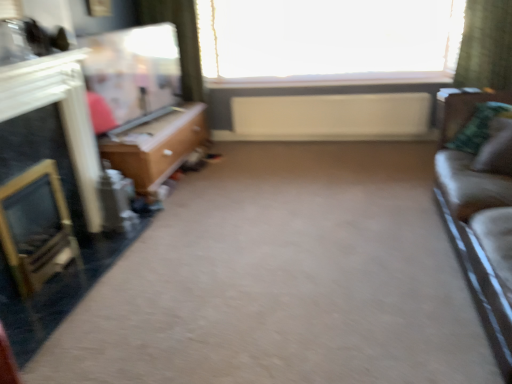
Question: From the image's perspective, is transparent glass window at upper center located above or below green fabric pillow at right, which ranks as the 2th pillow in back-to-front order?

Choices:
 (A) below
 (B) above

Answer: (B)

Question: Is point (331, 0) closer or farther from the camera than point (490, 165)?

Choices:
 (A) farther
 (B) closer

Answer: (A)

Question: Estimate the real-world distances between objects in this image. Which object is farther from the white matte radiator at center?

Choices:
 (A) white glossy fireplace at left
 (B) wooden desk at left
 (C) matte wood entertainment center at upper left
 (D) leather couch at right
 (E) green fabric pillow at right, arranged as the 1th pillow when viewed from the front

Answer: (A)

Question: Estimate the real-world distances between objects in this image. Which object is farther from the green plaid pillow at right, the first pillow from the back?

Choices:
 (A) wooden desk at left
 (B) matte wood entertainment center at upper left
 (C) green fabric pillow at right, arranged as the 1th pillow when viewed from the front
 (D) white glossy fireplace at left
 (E) transparent glass window at upper center

Answer: (D)